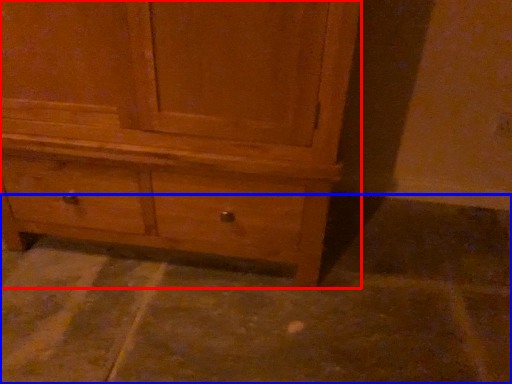
Question: Which object appears farthest to the camera in this image, chest of drawers (highlighted by a red box) or concrete (highlighted by a blue box)?

Choices:
 (A) chest of drawers
 (B) concrete

Answer: (B)